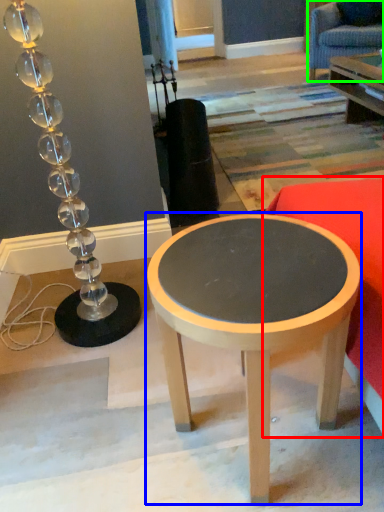
Question: Which is farther away from studio couch (highlighted by a red box)? coffee table (highlighted by a blue box) or swivel chair (highlighted by a green box)?

Choices:
 (A) coffee table
 (B) swivel chair

Answer: (B)